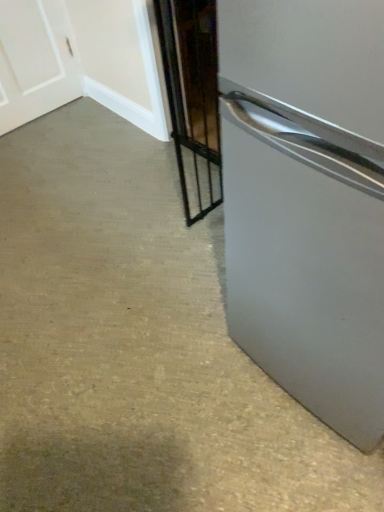
Measure the distance between black metal screen door at center and camera.

black metal screen door at center is 4.18 feet from camera.

What do you see at coordinates (193, 97) in the screenshot? This screenshot has height=512, width=384. I see `black metal screen door at center` at bounding box center [193, 97].

You are a GUI agent. You are given a task and a screenshot of the screen. Output one action in this format:
    pyautogui.click(x=<x>, y=<y>)
    Task: Click on the black metal screen door at center
    The image size is (384, 512).
    Given the screenshot: What is the action you would take?
    pyautogui.click(x=193, y=97)

Image resolution: width=384 pixels, height=512 pixels. I want to click on black metal screen door at center, so click(193, 97).